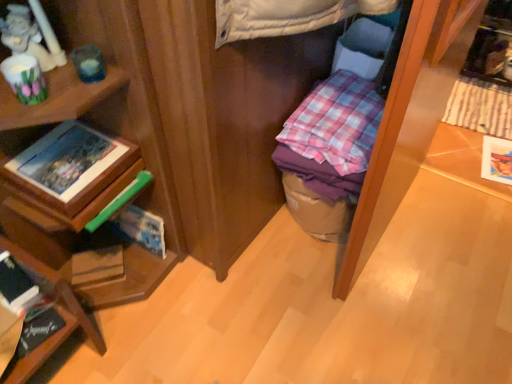
The width and height of the screenshot is (512, 384). Find the location of `vacant space to the right of wooden bookshelf at lower left`. vacant space to the right of wooden bookshelf at lower left is located at coordinates (140, 332).